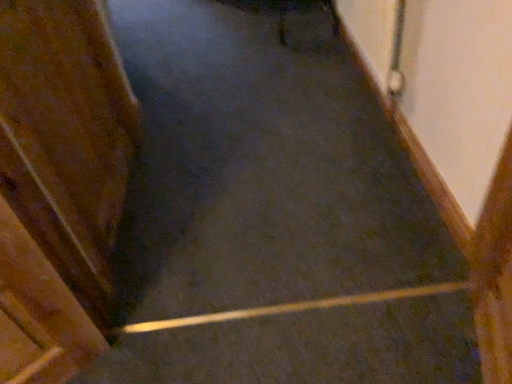
Describe the element at coordinates (59, 184) in the screenshot. I see `wooden door at left` at that location.

You are a GUI agent. You are given a task and a screenshot of the screen. Output one action in this format:
    pyautogui.click(x=<x>, y=<y>)
    Task: Click on the wooden door at left
    
    Given the screenshot: What is the action you would take?
    pyautogui.click(x=59, y=184)

The width and height of the screenshot is (512, 384). Describe the element at coordinates (305, 347) in the screenshot. I see `smooth concrete stairs at center` at that location.

Find the location of a particular element. smooth concrete stairs at center is located at coordinates (305, 347).

Where is `wooden door at left`? The image size is (512, 384). wooden door at left is located at coordinates (59, 184).

Between wooden door at left and smooth concrete stairs at center, which one appears on the left side from the viewer's perspective?

wooden door at left is more to the left.

Is wooden door at left in front of smooth concrete stairs at center?

Yes, wooden door at left is in front of smooth concrete stairs at center.

Does point (84, 91) come closer to viewer compared to point (414, 367)?

No.

From the image's perspective, which object appears higher, wooden door at left or smooth concrete stairs at center?

wooden door at left.

From a real-world perspective, is wooden door at left over smooth concrete stairs at center?

Yes, from a real-world perspective, wooden door at left is over smooth concrete stairs at center

In terms of width, does wooden door at left look wider or thinner when compared to smooth concrete stairs at center?

Clearly, wooden door at left has less width compared to smooth concrete stairs at center.

In terms of height, does wooden door at left look taller or shorter compared to smooth concrete stairs at center?

Clearly, wooden door at left is taller compared to smooth concrete stairs at center.

Is wooden door at left bigger than smooth concrete stairs at center?

Incorrect, wooden door at left is not larger than smooth concrete stairs at center.

Is wooden door at left spatially inside smooth concrete stairs at center, or outside of it?

wooden door at left is located beyond the bounds of smooth concrete stairs at center.

Is wooden door at left directly adjacent to smooth concrete stairs at center?

wooden door at left and smooth concrete stairs at center are not in contact.

Is wooden door at left oriented towards smooth concrete stairs at center?

No, wooden door at left is not facing towards smooth concrete stairs at center.

This screenshot has width=512, height=384. What are the coordinates of `stairs behind the wooden door at left` in the screenshot? It's located at (305, 347).

Does smooth concrete stairs at center appear on the left side of wooden door at left?

No.

Does smooth concrete stairs at center lie in front of wooden door at left?

No, smooth concrete stairs at center is further to the viewer.

Which is behind, point (152, 371) or point (42, 383)?

The point (152, 371) is farther from the camera.

Consider the image. From the image's perspective, does smooth concrete stairs at center appear higher than wooden door at left?

No, from the image's perspective, smooth concrete stairs at center is not on top of wooden door at left.

From a real-world perspective, is smooth concrete stairs at center on top of wooden door at left?

No, from a real-world perspective, smooth concrete stairs at center is not on top of wooden door at left.

Which of these two, smooth concrete stairs at center or wooden door at left, is thinner?

wooden door at left.

Does smooth concrete stairs at center have a lesser height compared to wooden door at left?

Yes.

Which of these two, smooth concrete stairs at center or wooden door at left, is bigger?

Bigger between the two is smooth concrete stairs at center.

Can we say smooth concrete stairs at center lies outside wooden door at left?

Absolutely, smooth concrete stairs at center is external to wooden door at left.

Are smooth concrete stairs at center and wooden door at left located far from each other?

Actually, smooth concrete stairs at center and wooden door at left are a little close together.

Could you tell me if smooth concrete stairs at center is turned towards wooden door at left?

No, smooth concrete stairs at center does not turn towards wooden door at left.

How many degrees apart are the facing directions of smooth concrete stairs at center and wooden door at left?

88.7 degrees separate the facing orientations of smooth concrete stairs at center and wooden door at left.

Locate an element on the screen. The width and height of the screenshot is (512, 384). door above the smooth concrete stairs at center (from the image's perspective) is located at coordinates (59, 184).

The image size is (512, 384). In order to click on stairs below the wooden door at left (from the image's perspective) in this screenshot , I will do `click(305, 347)`.

Find the location of a particular element. stairs on the right of wooden door at left is located at coordinates (305, 347).